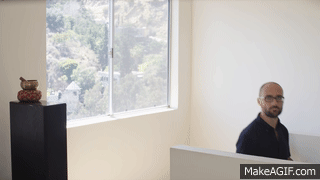
At what (x,y) coordinates should I click in order to perform the action: click on wall. Please return your answer as a coordinate pair (x, y). Looking at the image, I should click on (255, 34).